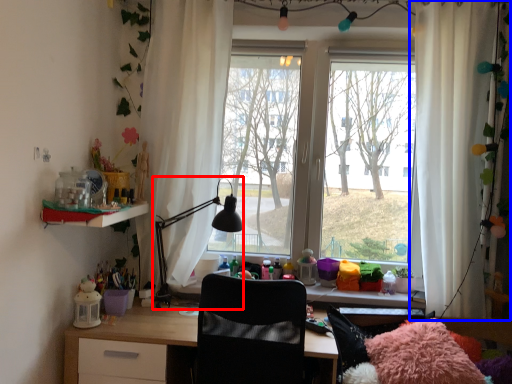
Question: Which of the following is the farthest to the observer, table lamp (highlighted by a red box) or curtain (highlighted by a blue box)?

Choices:
 (A) table lamp
 (B) curtain

Answer: (A)